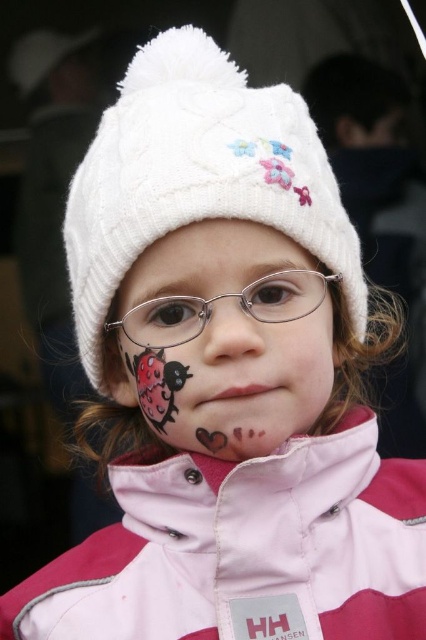
The child in the image is wearing a white knitted hat at center and metallic silver glasses at center. Based on their positions, which one is higher up on the child?

The white knitted hat at center is located above the metallic silver glasses at center, so it is higher up on the child.

You are a photographer trying to capture the child in the image. You want to ensure that both the white knitted hat at center and the matte plastic nose at center are clearly visible in your shot. Given their sizes, which object should you focus on first to ensure clarity?

The white knitted hat at center is taller than the matte plastic nose at center, so focusing on the white knitted hat at center first will ensure both are in focus since it is larger and farther away.

You are a fashion designer trying to create a matching accessory for the child in the image. The child has a white knitted hat at center and a matte plastic nose at center. Which object should you consider the width of to ensure the accessory fits properly?

The white knitted hat at center might be wider than the matte plastic nose at center, so you should consider the width of the white knitted hat at center to ensure the accessory fits properly.